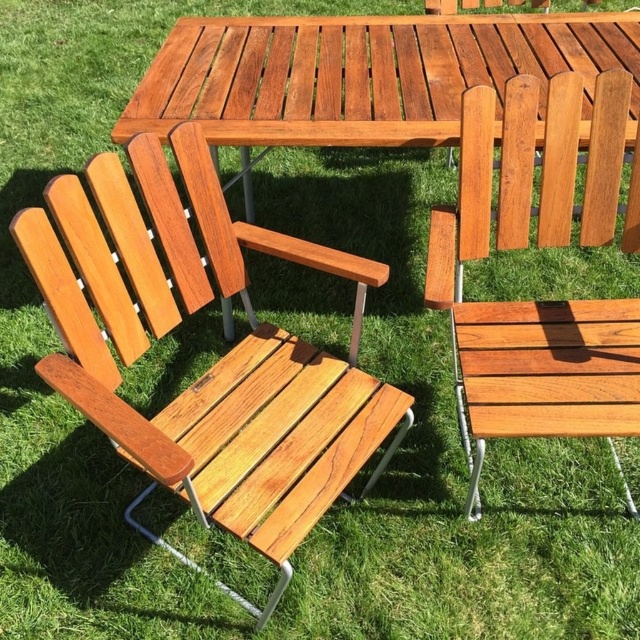
Between natural wood chair at center and glossy wood picnic table at center, which one is positioned lower?

natural wood chair at center

Can you confirm if natural wood chair at center is positioned above glossy wood picnic table at center?

Incorrect, natural wood chair at center is not positioned above glossy wood picnic table at center.

Measure the distance between point (582, 346) and camera.

Point (582, 346) and camera are 5.65 feet apart from each other.

Locate an element on the screen. The image size is (640, 640). natural wood chair at center is located at coordinates (524, 330).

Is point (65, 314) less distant than point (465, 353)?

Yes, it is.

Between natural wood chair at left and natural wood chair at center, which one is positioned higher?

Positioned higher is natural wood chair at center.

Find the location of `natural wood chair at left`. natural wood chair at left is located at coordinates (214, 364).

Find the location of a particular element. natural wood chair at left is located at coordinates pyautogui.click(x=214, y=364).

Which is above, natural wood chair at left or glossy wood picnic table at center?

glossy wood picnic table at center is above.

Does natural wood chair at left have a lesser height compared to glossy wood picnic table at center?

No.

Does point (170, 408) come closer to viewer compared to point (582, 108)?

Yes.

You are a GUI agent. You are given a task and a screenshot of the screen. Output one action in this format:
    pyautogui.click(x=<x>, y=<y>)
    Task: Click on the natural wood chair at left
    
    Given the screenshot: What is the action you would take?
    pyautogui.click(x=214, y=364)